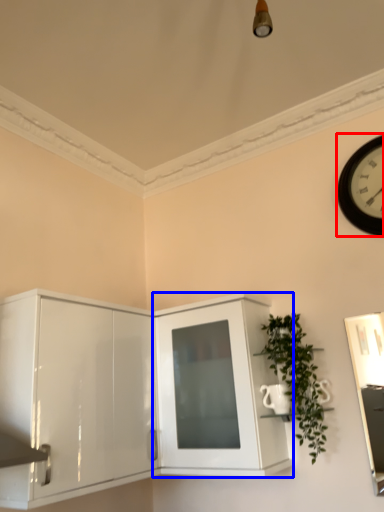
Question: Which object appears farthest to the camera in this image, wall clock (highlighted by a red box) or cabinetry (highlighted by a blue box)?

Choices:
 (A) wall clock
 (B) cabinetry

Answer: (A)